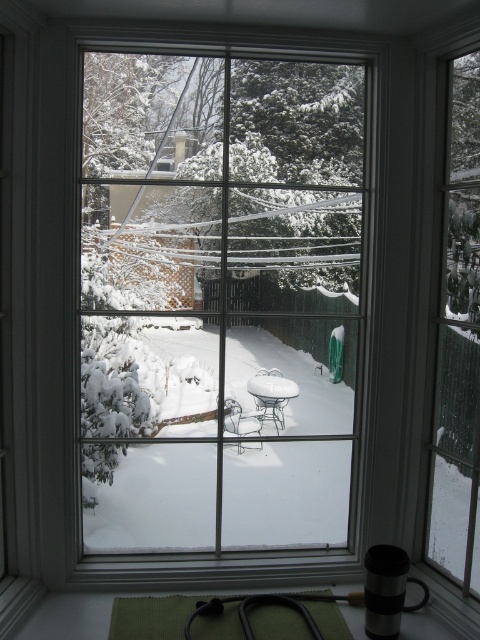
Question: Which point appears farthest from the camera in this image?

Choices:
 (A) (179, 86)
 (B) (475, 554)

Answer: (A)

Question: Can you confirm if clear glass window at center is smaller than clear glass window at right?

Choices:
 (A) yes
 (B) no

Answer: (B)

Question: Which point is closer to the camera taking this photo?

Choices:
 (A) (468, 115)
 (B) (308, 356)

Answer: (A)

Question: Observing the image, what is the correct spatial positioning of clear glass window at center in reference to clear glass window at right?

Choices:
 (A) right
 (B) left

Answer: (B)

Question: Observing the image, what is the correct spatial positioning of clear glass window at center in reference to clear glass window at right?

Choices:
 (A) below
 (B) above

Answer: (B)